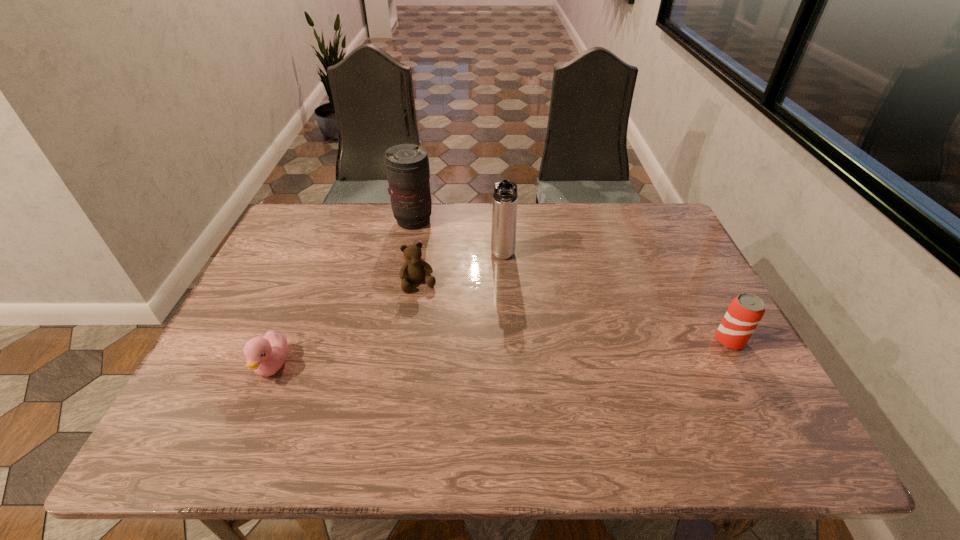
Image resolution: width=960 pixels, height=540 pixels. Identify the location of vacant point located 0.100m on the handle side of the fourth nearest object. (504, 293).

You are a GUI agent. You are given a task and a screenshot of the screen. Output one action in this format:
    pyautogui.click(x=<x>, y=<y>)
    Task: Click on the free location located on the side of the telephoto lens where the control switches are located
    The image size is (960, 540).
    Given the screenshot: What is the action you would take?
    pyautogui.click(x=445, y=251)

At what (x,y) coordinates should I click in order to perform the action: click on vacant space located on the side of the telephoto lens where the control switches are located. Please return your answer as a coordinate pair (x, y). Looking at the image, I should click on (460, 265).

At what (x,y) coordinates should I click in order to perform the action: click on vacant space situated 0.160m on the side of the telephoto lens where the control switches are located. Please return your answer as a coordinate pair (x, y). Image resolution: width=960 pixels, height=540 pixels. Looking at the image, I should click on (451, 256).

Locate an element on the screen. free space located 0.210m on the front-facing side of the third nearest object is located at coordinates (443, 354).

This screenshot has height=540, width=960. What are the coordinates of `free space located 0.130m on the front-facing side of the third nearest object` in the screenshot? It's located at point(435,329).

The width and height of the screenshot is (960, 540). I want to click on free space located 0.360m on the front-facing side of the third nearest object, so click(x=460, y=407).

Find the location of a particular element. The width and height of the screenshot is (960, 540). thermos bottle situated at the far edge is located at coordinates (504, 212).

Locate an element on the screen. Image resolution: width=960 pixels, height=540 pixels. telephoto lens that is at the far edge is located at coordinates (407, 165).

Identify the location of object present at the near edge. (266, 355).